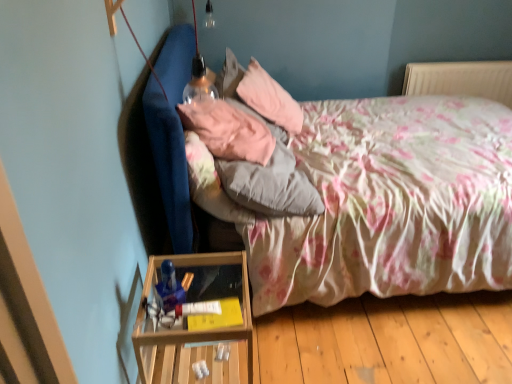
Question: Is pink fabric pillow at upper center, acting as the 1th pillow starting from the front, oriented towards velvet pink pillow at upper center, the 2th pillow from the front?

Choices:
 (A) yes
 (B) no

Answer: (B)

Question: Is pink fabric pillow at upper center, acting as the 1th pillow starting from the front, far from velvet pink pillow at upper center, the first pillow when ordered from back to front?

Choices:
 (A) no
 (B) yes

Answer: (A)

Question: Is pink fabric pillow at upper center, the second pillow when ordered from back to front, further to the viewer compared to velvet pink pillow at upper center, the 2th pillow from the front?

Choices:
 (A) yes
 (B) no

Answer: (B)

Question: Is pink fabric pillow at upper center, acting as the 1th pillow starting from the front, turned away from velvet pink pillow at upper center, the first pillow when ordered from back to front?

Choices:
 (A) yes
 (B) no

Answer: (B)

Question: Does pink fabric pillow at upper center, the second pillow when ordered from back to front, contain velvet pink pillow at upper center, the 2th pillow from the front?

Choices:
 (A) yes
 (B) no

Answer: (B)

Question: Is point (205, 107) positioned closer to the camera than point (295, 117)?

Choices:
 (A) farther
 (B) closer

Answer: (B)

Question: In the image, is pink fabric pillow at upper center, acting as the 1th pillow starting from the front, on the left side or the right side of velvet pink pillow at upper center, the first pillow when ordered from back to front?

Choices:
 (A) right
 (B) left

Answer: (B)

Question: From a real-world perspective, is pink fabric pillow at upper center, acting as the 1th pillow starting from the front, positioned above or below velvet pink pillow at upper center, the first pillow when ordered from back to front?

Choices:
 (A) below
 (B) above

Answer: (B)

Question: Would you say pink fabric pillow at upper center, the second pillow when ordered from back to front, is inside or outside velvet pink pillow at upper center, the 2th pillow from the front?

Choices:
 (A) outside
 (B) inside

Answer: (A)

Question: Visually, is velvet pink pillow at upper center, the 2th pillow from the front, positioned to the left or to the right of pink fabric pillow at upper center, acting as the 1th pillow starting from the front?

Choices:
 (A) left
 (B) right

Answer: (B)

Question: Considering the positions of velvet pink pillow at upper center, the first pillow when ordered from back to front, and pink fabric pillow at upper center, acting as the 1th pillow starting from the front, in the image, is velvet pink pillow at upper center, the first pillow when ordered from back to front, taller or shorter than pink fabric pillow at upper center, acting as the 1th pillow starting from the front,?

Choices:
 (A) short
 (B) tall

Answer: (B)

Question: Is point (248, 69) closer or farther from the camera than point (208, 127)?

Choices:
 (A) closer
 (B) farther

Answer: (B)

Question: Relative to pink fabric pillow at upper center, the second pillow when ordered from back to front, is velvet pink pillow at upper center, the first pillow when ordered from back to front, in front or behind?

Choices:
 (A) behind
 (B) front

Answer: (A)

Question: From the image's perspective, relative to floral fabric bed at center, is pink fabric pillow at upper center, acting as the 1th pillow starting from the front, above or below?

Choices:
 (A) above
 (B) below

Answer: (A)

Question: Is pink fabric pillow at upper center, acting as the 1th pillow starting from the front, taller or shorter than floral fabric bed at center?

Choices:
 (A) short
 (B) tall

Answer: (A)